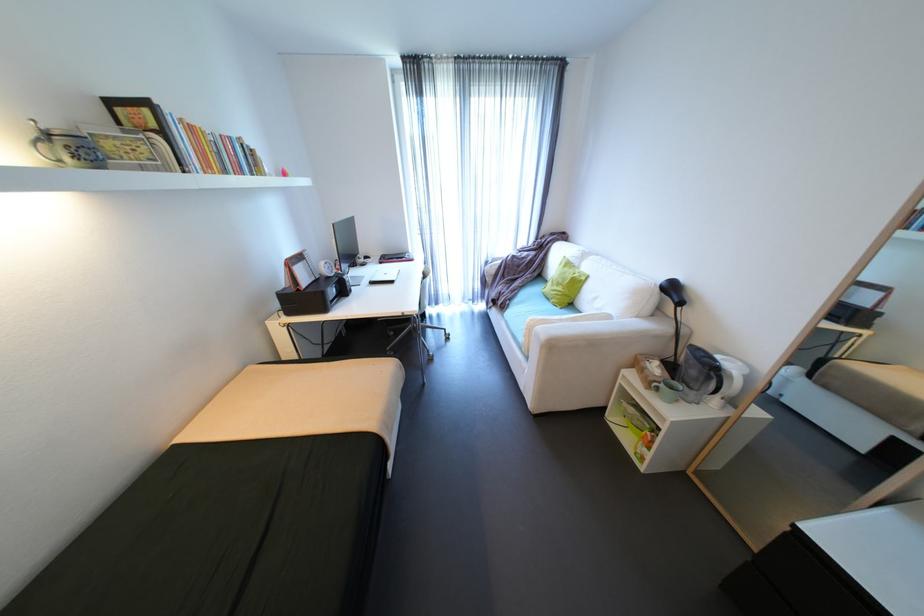
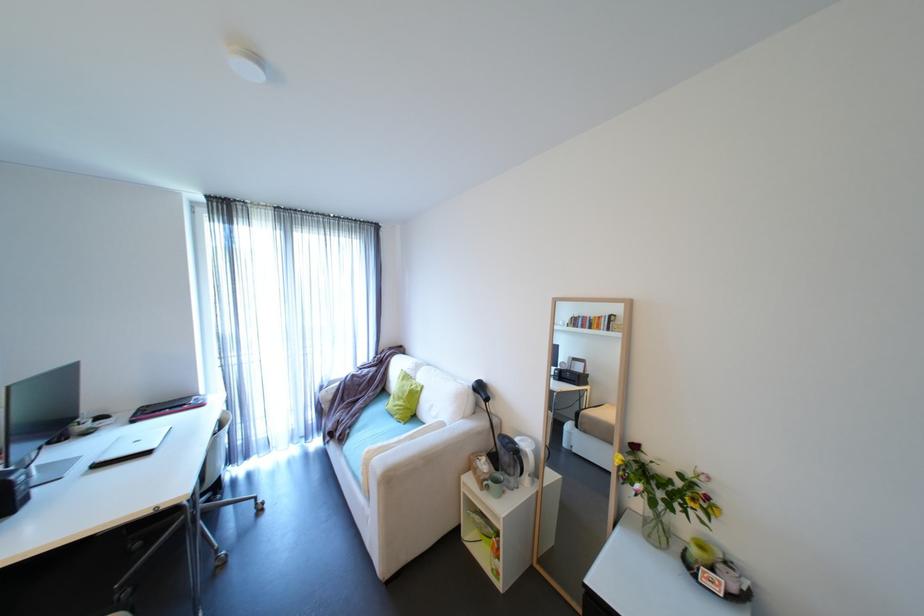
The point at (497, 262) is marked in the first image. Where is the corresponding point in the second image?

(333, 386)